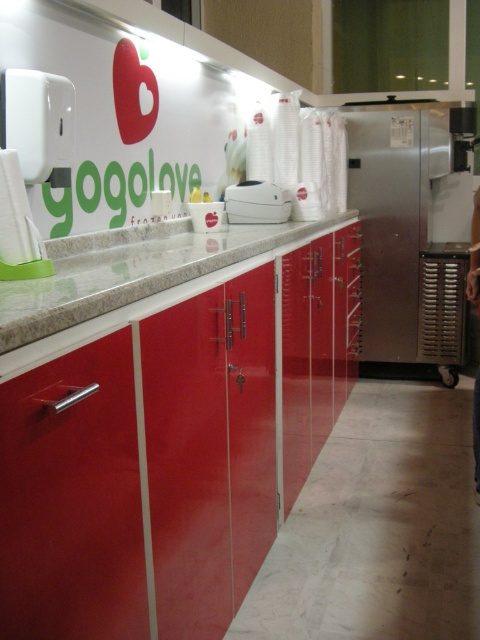
You are a customer at Gogolove frozen yogurt shop and want to grab a yogurt cup from the granite countertop at center. However, there is a stainless steel refrigerator at right blocking your path. Can you reach the yogurt cup without moving the refrigerator?

The stainless steel refrigerator at right is located above the granite countertop at center, so it does not block the path. You can easily reach the yogurt cup from the granite countertop at center without moving the refrigerator.

You are a customer at Gogolove frozen yogurt shop and want to place your phone on the counter. The phone is 15 cm long. Can you put it on the granite countertop at center without overlapping the white plastic toaster at center?

The granite countertop at center is wider than the white plastic toaster at center, so yes, you can place your phone on the granite countertop at center without overlapping the white plastic toaster at center as there is enough space.